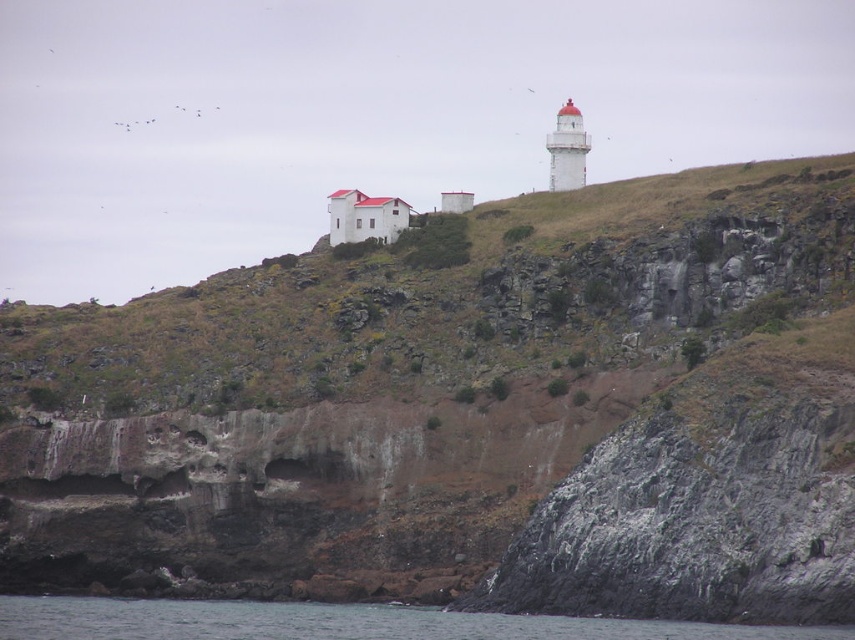
Question: Is brown rocky hillside at upper center smaller than white painted lighthouse at upper right?

Choices:
 (A) no
 (B) yes

Answer: (A)

Question: Does brown rocky hillside at upper center appear on the right side of white painted lighthouse at upper right?

Choices:
 (A) no
 (B) yes

Answer: (A)

Question: Among these points, which one is nearest to the camera?

Choices:
 (A) (565, 186)
 (B) (276, 358)

Answer: (B)

Question: Is brown rocky hillside at upper center closer to camera compared to transparent blue water at lower left?

Choices:
 (A) no
 (B) yes

Answer: (A)

Question: Which point is farther to the camera?

Choices:
 (A) (275, 397)
 (B) (549, 173)
 (C) (101, 596)

Answer: (B)

Question: Which object appears farthest from the camera in this image?

Choices:
 (A) brown rocky hillside at upper center
 (B) transparent blue water at lower left

Answer: (A)